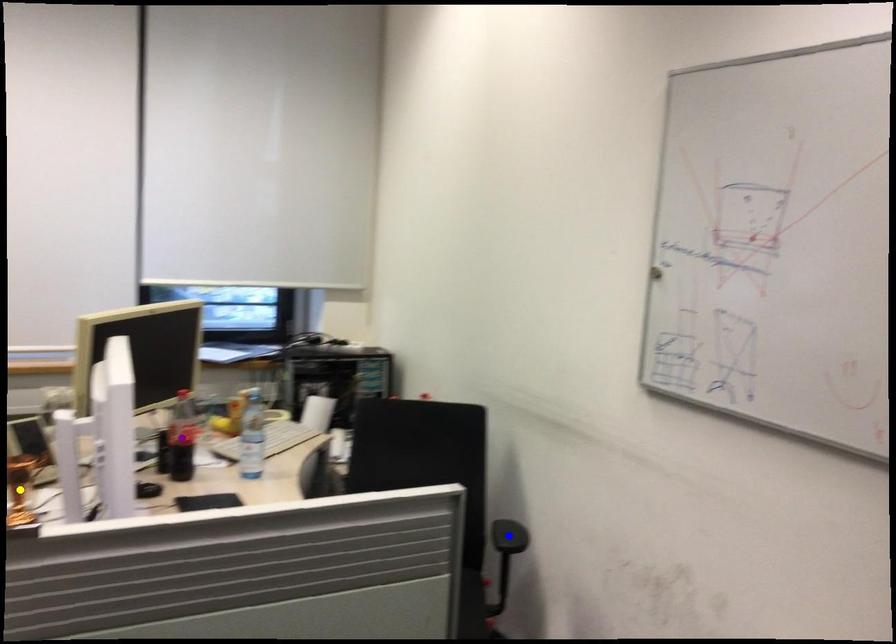
Order these from nearest to farthest:
A) blue point
B) yellow point
C) purple point

blue point < purple point < yellow point